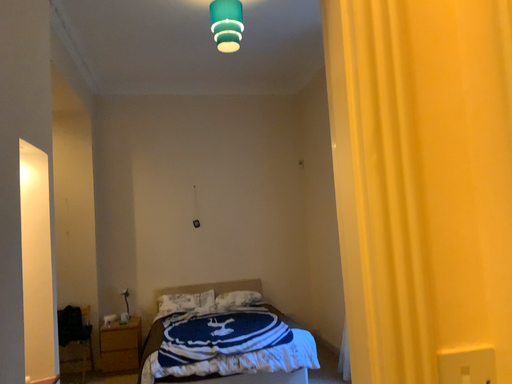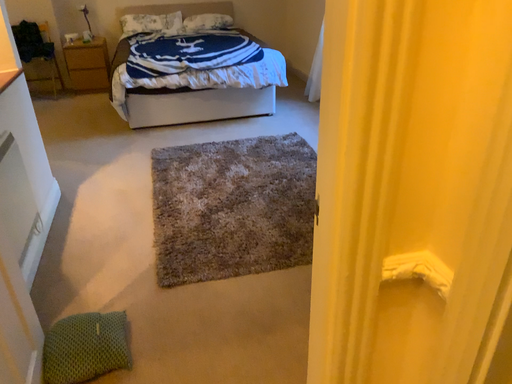
Question: How did the camera likely rotate when shooting the video?

Choices:
 (A) rotated upward
 (B) rotated downward

Answer: (B)